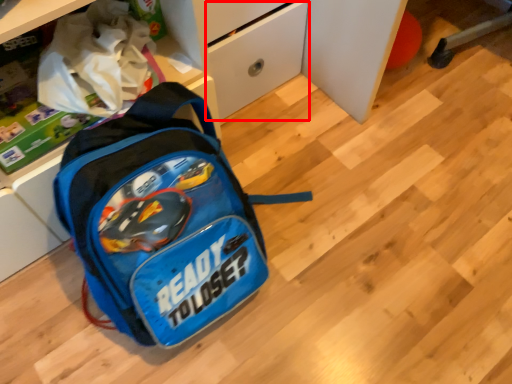
Question: From the image's perspective, where is drawer (annotated by the red box) located relative to backpack?

Choices:
 (A) above
 (B) below

Answer: (A)